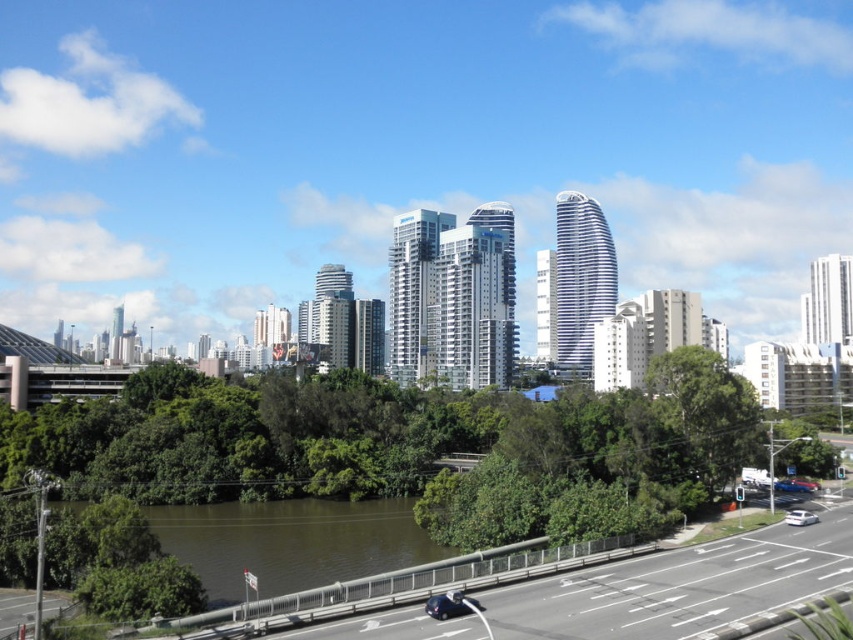
Based on the photo, which is below, greenish-brown water at center or shiny blue car at lower center?

Positioned lower is greenish-brown water at center.

Is greenish-brown water at center closer to camera compared to shiny blue car at lower center?

No, greenish-brown water at center is further to the viewer.

The width and height of the screenshot is (853, 640). In order to click on greenish-brown water at center in this screenshot , I will do `click(291, 541)`.

Between green leafy tree at center and shiny blue car at lower center, which one is positioned higher?

Positioned higher is green leafy tree at center.

Measure the distance between point (691, 467) and camera.

Point (691, 467) is 88.78 meters from camera.

Identify the location of green leafy tree at center. (705, 412).

Does greenish-brown water at center have a greater height compared to blue metallic car at lower right?

Indeed, greenish-brown water at center has a greater height compared to blue metallic car at lower right.

You are a GUI agent. You are given a task and a screenshot of the screen. Output one action in this format:
    pyautogui.click(x=<x>, y=<y>)
    Task: Click on the greenish-brown water at center
    This screenshot has width=853, height=640.
    Given the screenshot: What is the action you would take?
    pyautogui.click(x=291, y=541)

What do you see at coordinates (291, 541) in the screenshot?
I see `greenish-brown water at center` at bounding box center [291, 541].

I want to click on greenish-brown water at center, so click(291, 541).